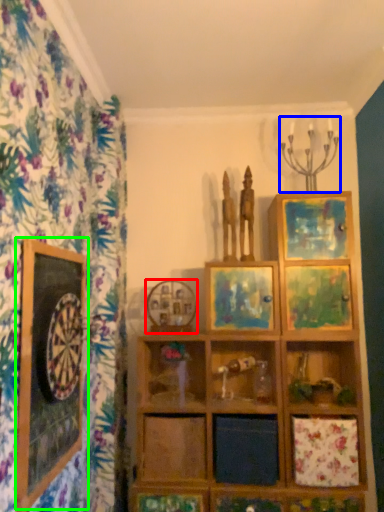
Question: Which object is positioned farthest from picture frame (highlighted by a red box)? Select from candle holder (highlighted by a blue box) and picture frame (highlighted by a green box).

Choices:
 (A) candle holder
 (B) picture frame

Answer: (A)